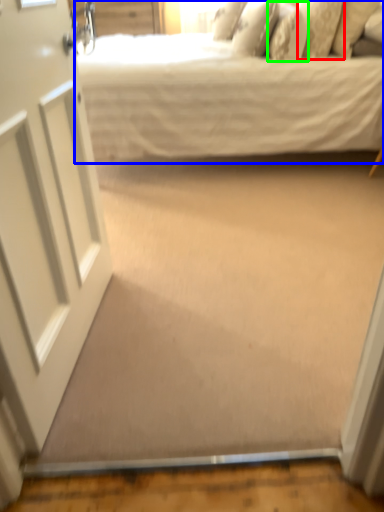
Question: Based on their relative distances, which object is farther from pillow (highlighted by a red box)? Choose from bed (highlighted by a blue box) and pillow (highlighted by a green box).

Choices:
 (A) bed
 (B) pillow

Answer: (A)